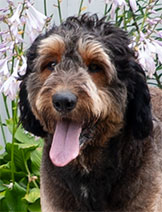
Find the location of `chest`. chest is located at coordinates (85, 179).